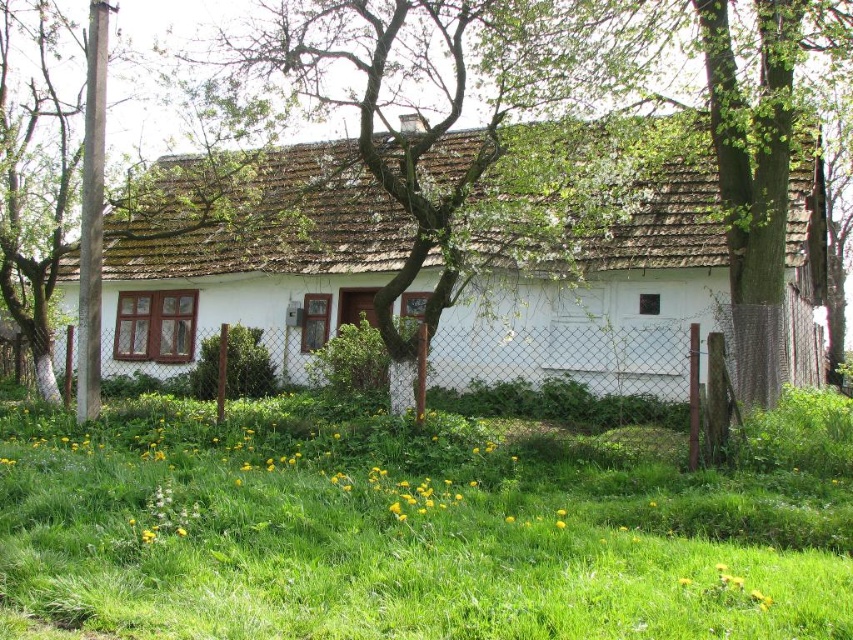
Is white matte house at center to the left of white wire mesh fence at center from the viewer's perspective?

Indeed, white matte house at center is positioned on the left side of white wire mesh fence at center.

Is white matte house at center further to camera compared to white wire mesh fence at center?

Yes, white matte house at center is further from the viewer.

Image resolution: width=853 pixels, height=640 pixels. Find the location of `white matte house at center`. white matte house at center is located at coordinates (593, 266).

Which is more to the left, green grass at lower center or white matte house at center?

From the viewer's perspective, green grass at lower center appears more on the left side.

Is point (317, 564) in front of point (134, 241)?

Yes, point (317, 564) is closer to viewer.

Who is more forward, (426, 513) or (804, 186)?

Point (426, 513)

Where is `green grass at lower center`? green grass at lower center is located at coordinates tap(401, 531).

Does white matte house at center have a greater width compared to green bark pole at left?

Indeed, white matte house at center has a greater width compared to green bark pole at left.

Between point (247, 234) and point (38, 252), which one is positioned behind?

The point (247, 234) is more distant.

Does point (624, 296) lie in front of point (13, 179)?

No, (624, 296) is behind (13, 179).

The width and height of the screenshot is (853, 640). In order to click on white matte house at center in this screenshot , I will do `click(593, 266)`.